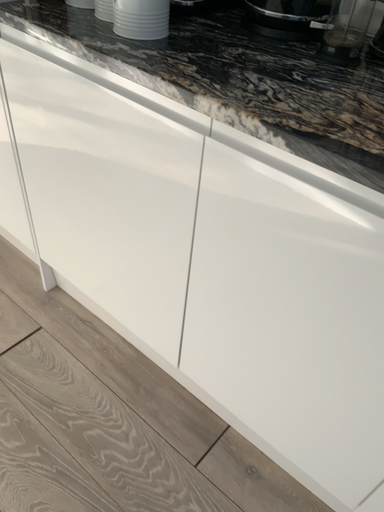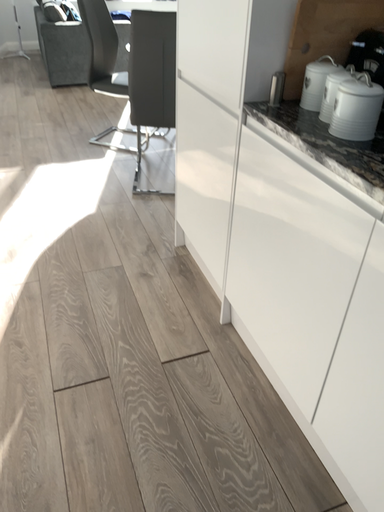
Question: Which way did the camera rotate in the video?

Choices:
 (A) rotated downward
 (B) rotated upward

Answer: (B)